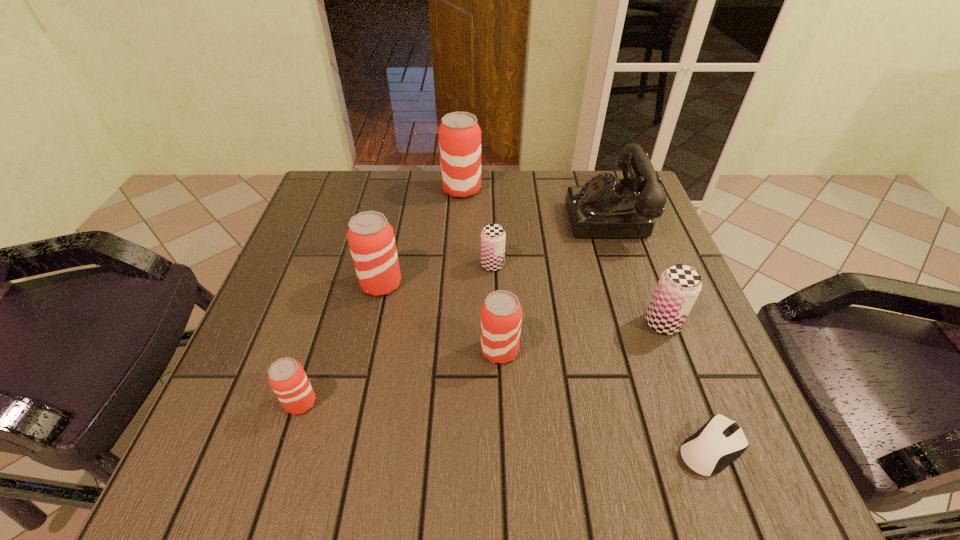
I want to click on free space located on the front of the right purple beer can, so click(x=718, y=471).

The image size is (960, 540). What are the coordinates of `vacant space positioned 0.280m on the right of the left purple beer can` in the screenshot? It's located at (631, 265).

This screenshot has width=960, height=540. In order to click on vacant space located 0.290m on the right of the second nearest object in this screenshot , I will do `click(489, 402)`.

What are the coordinates of `vacant space located 0.220m on the left of the white mouse` in the screenshot? It's located at (535, 447).

Identify the location of beer can that is at the far edge. (459, 133).

Identify the location of telephone that is at the far edge. This screenshot has width=960, height=540. (604, 207).

You are a GUI agent. You are given a task and a screenshot of the screen. Output one action in this format:
    pyautogui.click(x=<x>, y=<y>)
    Task: Click on the object that is at the near edge
    
    Given the screenshot: What is the action you would take?
    pyautogui.click(x=720, y=441)

Where is `object present at the left edge`? The image size is (960, 540). object present at the left edge is located at coordinates (287, 378).

The width and height of the screenshot is (960, 540). I want to click on telephone present at the right edge, so click(604, 207).

Find the location of a particular element. This screenshot has width=960, height=540. beer can at the right edge is located at coordinates (679, 286).